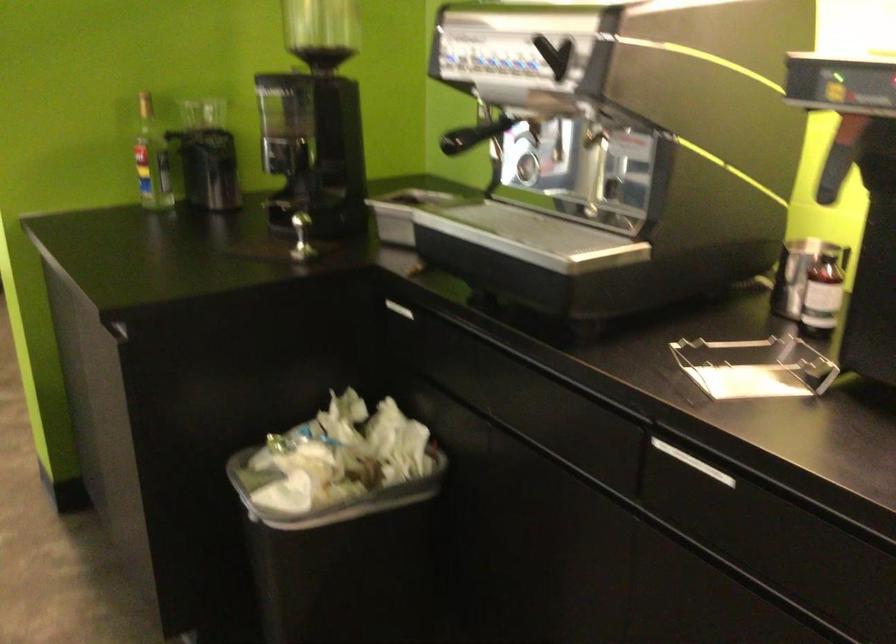
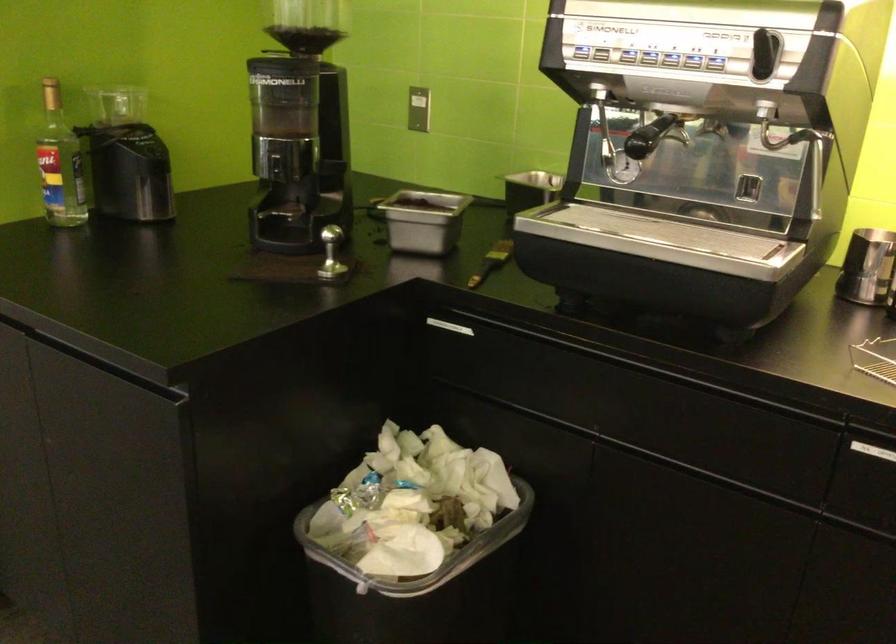
Question: The first image is from the beginning of the video and the second image is from the end. How did the camera likely rotate when shooting the video?

Choices:
 (A) Left
 (B) Right
 (C) Up
 (D) Down

Answer: (B)